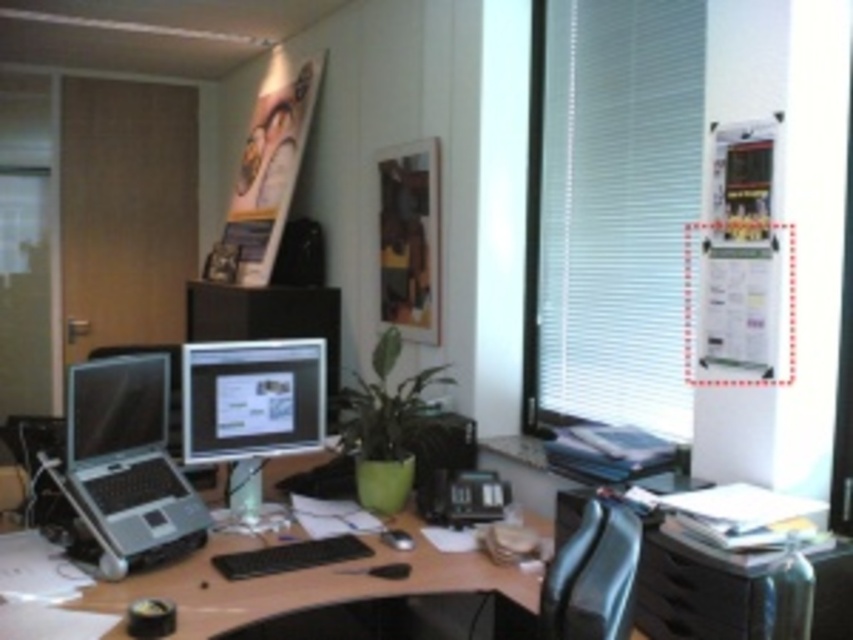
You are organizing your desk and want to place both the matte black laptop at left and the matte black monitor at left on a shelf. The shelf has enough space for one large item. Which one should you place first to maximize shelf usage?

The matte black laptop at left is larger in size than the matte black monitor at left, so you should place the matte black laptop at left first to utilize the shelf space effectively.

You are organizing the office space and need to place a new standing desk that requires a height adjustment. The current desk is the matte black desk at center, and there is also a matte black monitor at center. Which object is shorter and needs to be adjusted to match the monitor?

The matte black desk at center is shorter than the matte black monitor at center, so the desk needs to be adjusted to match the monitor.

Looking at this image, you are an office worker who wants to place a new wireless speaker on your desk. The speaker is 1.2 meters wide. The desk is at center and the monitor is also at center. Can the speaker fit on the matte black desk at center without overlapping the matte black monitor at center?

The matte black desk at center is larger than the matte black monitor at center. Since the desk is bigger, there should be enough space to place the 1.2 meter wide speaker without overlapping the monitor.